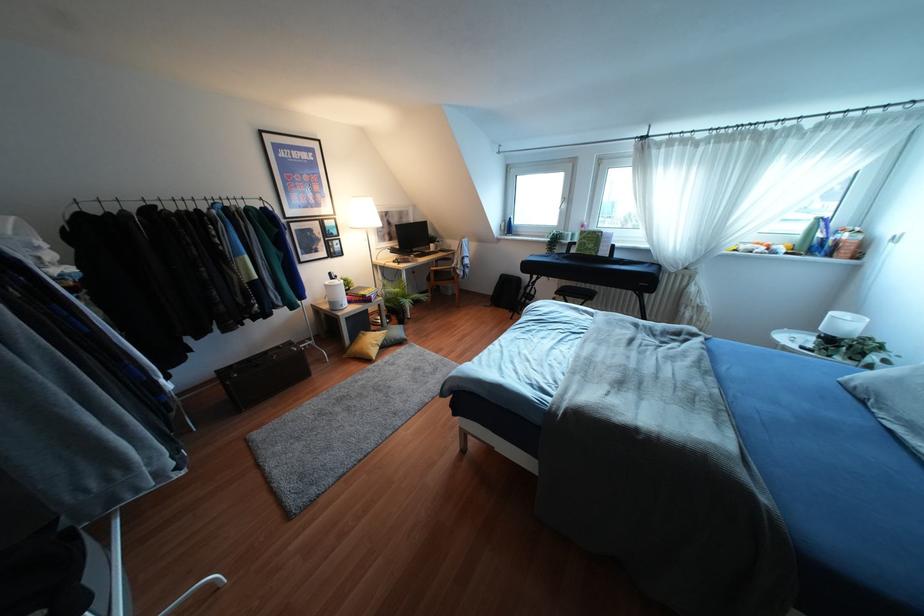
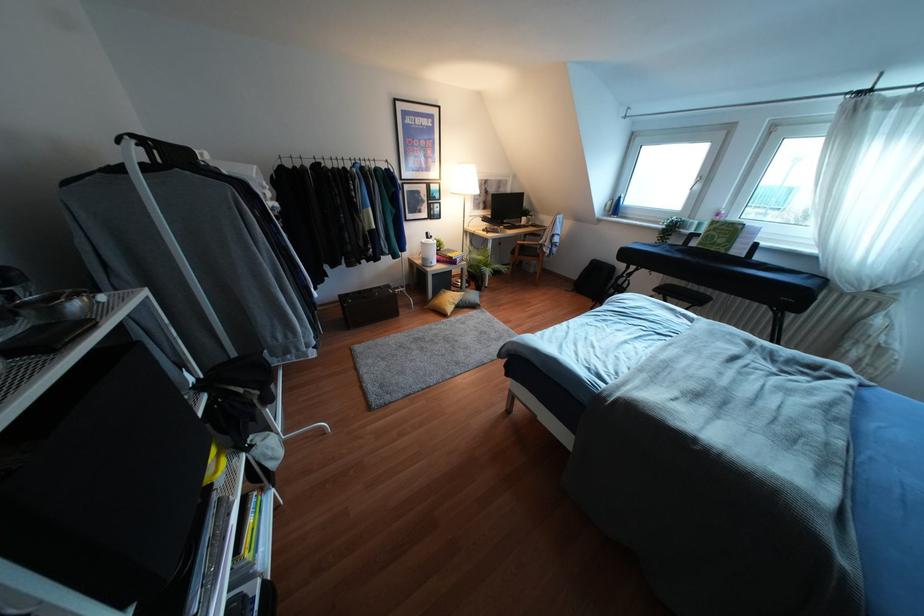
The point at (563, 199) is marked in the first image. Where is the corresponding point in the second image?

(699, 177)